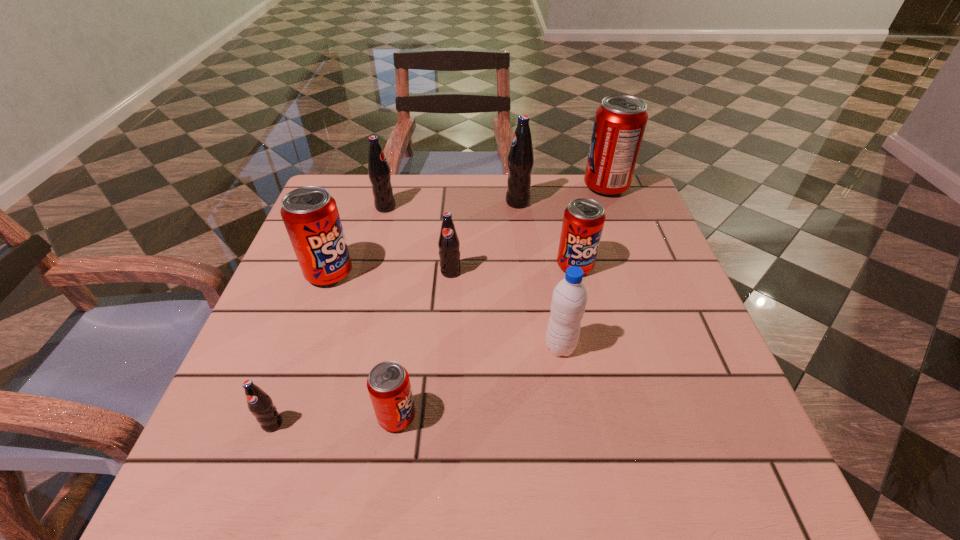
Locate an element on the screen. the fourth soda can from right to left is located at coordinates (448, 243).

What are the coordinates of `the third red soda can from left to right` in the screenshot? It's located at coord(583,221).

Identify the location of the second smallest red soda can. (583, 221).

Image resolution: width=960 pixels, height=540 pixels. In order to click on the leftmost black pop in this screenshot , I will do `click(260, 404)`.

Locate an element on the screen. The image size is (960, 540). the nearest black pop is located at coordinates (260, 404).

Identify the location of the fourth object from left to right. Image resolution: width=960 pixels, height=540 pixels. (388, 383).

Where is `the smallest red soda can`? The height and width of the screenshot is (540, 960). the smallest red soda can is located at coordinates (388, 383).

Identify the location of vacant region located 0.310m on the front of the rightmost object. The height and width of the screenshot is (540, 960). (641, 281).

The height and width of the screenshot is (540, 960). I want to click on vacant space positioned 0.380m on the front label of the third soda can from right to left, so click(361, 202).

This screenshot has width=960, height=540. Identify the location of blank space located 0.340m on the front label of the third soda can from right to left. (376, 202).